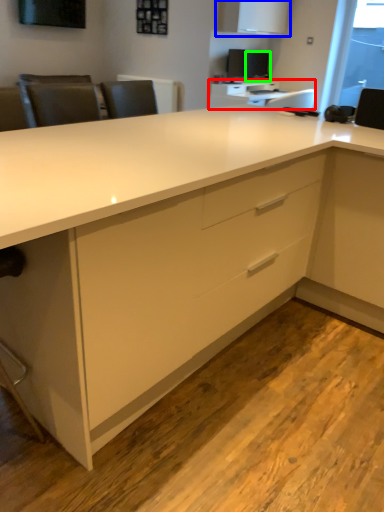
Question: Based on their relative distances, which object is nearer to table (highlighted by a red box)? Choose from cabinetry (highlighted by a blue box) and computer monitor (highlighted by a green box).

Choices:
 (A) cabinetry
 (B) computer monitor

Answer: (A)